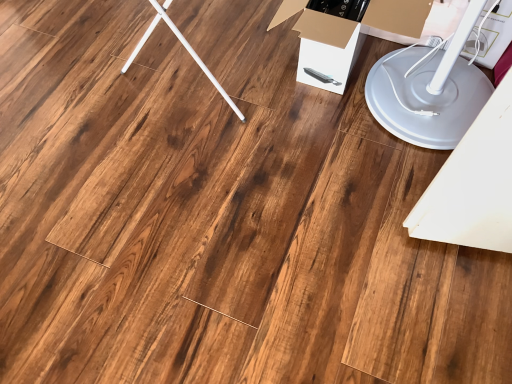
Question: Is white cardboard box at center next to white plastic lift at lower right and touching it?

Choices:
 (A) yes
 (B) no

Answer: (B)

Question: Could you tell me if white cardboard box at center is turned towards white plastic lift at lower right?

Choices:
 (A) yes
 (B) no

Answer: (A)

Question: From the image's perspective, does white cardboard box at center appear lower than white plastic lift at lower right?

Choices:
 (A) no
 (B) yes

Answer: (A)

Question: Does white cardboard box at center appear on the left side of white plastic lift at lower right?

Choices:
 (A) no
 (B) yes

Answer: (B)

Question: Is white cardboard box at center further to the viewer compared to white plastic lift at lower right?

Choices:
 (A) yes
 (B) no

Answer: (A)

Question: Are white cardboard box at center and white plastic lift at lower right far apart?

Choices:
 (A) no
 (B) yes

Answer: (A)

Question: Can you confirm if white plastic lift at lower right is wider than white cardboard box at center?

Choices:
 (A) no
 (B) yes

Answer: (B)

Question: Does white plastic lift at lower right appear on the right side of white cardboard box at center?

Choices:
 (A) no
 (B) yes

Answer: (B)

Question: From the image's perspective, is white plastic lift at lower right above white cardboard box at center?

Choices:
 (A) no
 (B) yes

Answer: (A)

Question: Does white plastic lift at lower right have a larger size compared to white cardboard box at center?

Choices:
 (A) yes
 (B) no

Answer: (A)

Question: Can you confirm if white plastic lift at lower right is thinner than white cardboard box at center?

Choices:
 (A) no
 (B) yes

Answer: (A)

Question: Is white plastic lift at lower right behind white cardboard box at center?

Choices:
 (A) yes
 (B) no

Answer: (B)

Question: From the image's perspective, is white plastic lift at lower right above or below white cardboard box at center?

Choices:
 (A) above
 (B) below

Answer: (B)